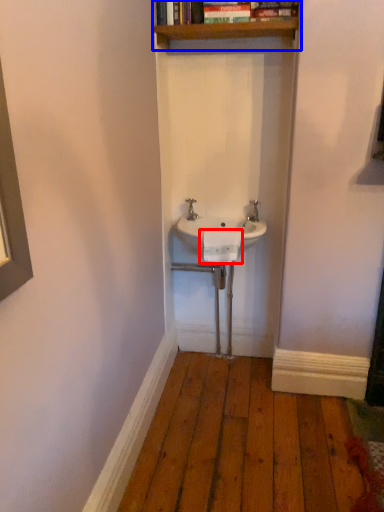
Question: Which of the following is the closest to the observer, towel bar (highlighted by a red box) or shelf (highlighted by a blue box)?

Choices:
 (A) towel bar
 (B) shelf

Answer: (B)